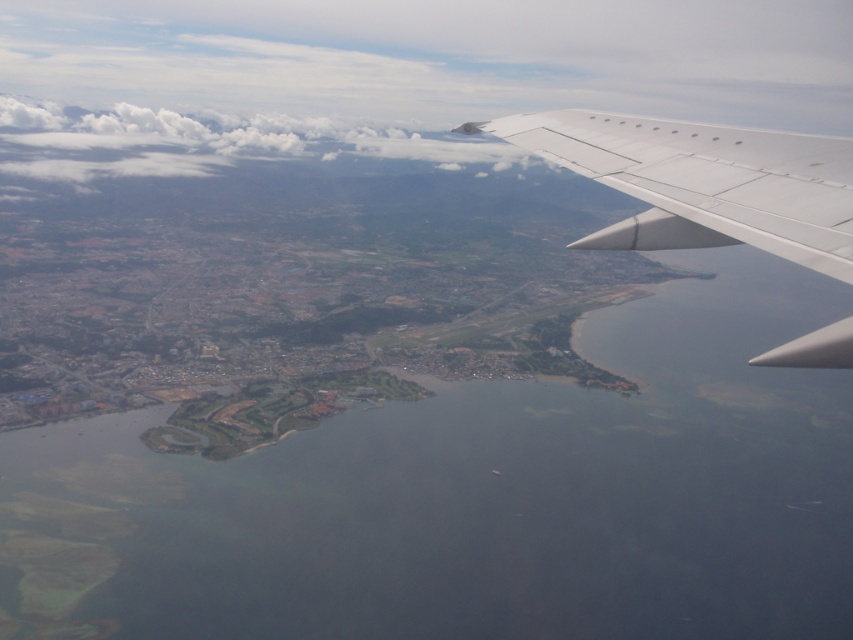
You are a passenger sitting near the window of an airplane and see two points marked on the wing and the landscape below. Which point, point (601, 132) or point (505, 156), is closer to your eyes?

Point (601, 132) is closer to the camera than point (505, 156), so it is closer to your eyes.

You are a passenger on an airplane and looking out the window. You notice the white matte wing at upper right and the white fluffy cloud at upper left. Which object is taller from your viewpoint?

The white fluffy cloud at upper left is taller than the white matte wing at upper right.